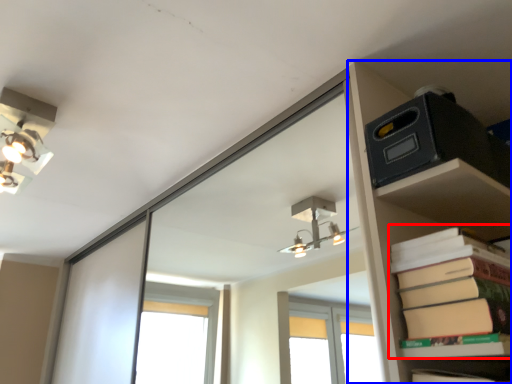
Question: Which of the following is the closest to the observer, paperback book (highlighted by a red box) or shelf (highlighted by a blue box)?

Choices:
 (A) paperback book
 (B) shelf

Answer: (A)